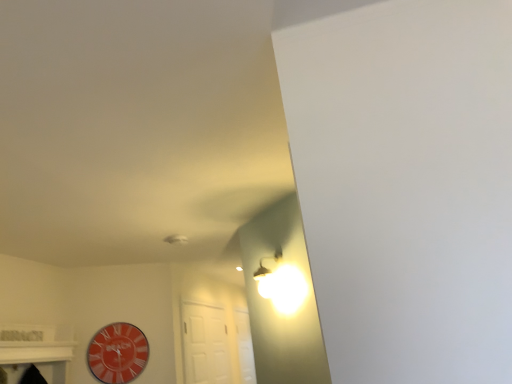
This screenshot has width=512, height=384. What do you see at coordinates (117, 353) in the screenshot? I see `orange glossy clock at lower left` at bounding box center [117, 353].

Find the location of `orange glossy clock at lower left`. orange glossy clock at lower left is located at coordinates (117, 353).

Locate an element on the screen. white matte door at center is located at coordinates (205, 344).

What do you see at coordinates (205, 344) in the screenshot?
I see `white matte door at center` at bounding box center [205, 344].

Locate an element on the screen. orange glossy clock at lower left is located at coordinates (117, 353).

Can you confirm if orange glossy clock at lower left is positioned to the left of white matte door at center?

Yes, orange glossy clock at lower left is to the left of white matte door at center.

Considering the relative positions of orange glossy clock at lower left and white matte door at center in the image provided, is orange glossy clock at lower left behind white matte door at center?

No.

Is point (133, 370) less distant than point (209, 345)?

Yes.

From the image's perspective, which is below, orange glossy clock at lower left or white matte door at center?

white matte door at center.

From a real-world perspective, is orange glossy clock at lower left physically located above or below white matte door at center?

In terms of real-world spatial position, orange glossy clock at lower left is above white matte door at center.

In the scene shown: Is orange glossy clock at lower left wider or thinner than white matte door at center?

Considering their sizes, orange glossy clock at lower left looks slimmer than white matte door at center.

From their relative heights in the image, would you say orange glossy clock at lower left is taller or shorter than white matte door at center?

orange glossy clock at lower left is shorter than white matte door at center.

Which of these two, orange glossy clock at lower left or white matte door at center, is smaller?

orange glossy clock at lower left.

In the scene shown: Is orange glossy clock at lower left not within white matte door at center?

Yes, orange glossy clock at lower left is outside of white matte door at center.

Is orange glossy clock at lower left not close to white matte door at center?

That's not correct — orange glossy clock at lower left is a little close to white matte door at center.

Is orange glossy clock at lower left oriented away from white matte door at center?

orange glossy clock at lower left does not have its back to white matte door at center.

How far apart are orange glossy clock at lower left and white matte door at center?

The distance of orange glossy clock at lower left from white matte door at center is 91.08 centimeters.

At what (x,y) coordinates should I click in order to perform the action: click on door lying behind the orange glossy clock at lower left. Please return your answer as a coordinate pair (x, y). Image resolution: width=512 pixels, height=384 pixels. Looking at the image, I should click on (205, 344).

Considering the relative positions of white matte door at center and orange glossy clock at lower left in the image provided, is white matte door at center to the left or to the right of orange glossy clock at lower left?

Clearly, white matte door at center is on the right of orange glossy clock at lower left in the image.

Is white matte door at center in front of or behind orange glossy clock at lower left in the image?

In the image, white matte door at center appears behind orange glossy clock at lower left.

Between point (205, 341) and point (137, 360), which one is positioned behind?

The point (205, 341) is farther from the camera.

From the image's perspective, between white matte door at center and orange glossy clock at lower left, who is located below?

white matte door at center appears lower in the image.

From a real-world perspective, is white matte door at center below orange glossy clock at lower left?

Yes, from a real-world perspective, white matte door at center is beneath orange glossy clock at lower left.

In the scene shown: Considering the relative sizes of white matte door at center and orange glossy clock at lower left in the image provided, is white matte door at center thinner than orange glossy clock at lower left?

In fact, white matte door at center might be wider than orange glossy clock at lower left.

Is white matte door at center taller or shorter than orange glossy clock at lower left?

white matte door at center is taller than orange glossy clock at lower left.

Considering the sizes of objects white matte door at center and orange glossy clock at lower left in the image provided, who is bigger, white matte door at center or orange glossy clock at lower left?

Bigger between the two is white matte door at center.

Do you think white matte door at center is within orange glossy clock at lower left, or outside of it?

white matte door at center is not enclosed by orange glossy clock at lower left.

Consider the image. Is white matte door at center positioned far away from orange glossy clock at lower left?

white matte door at center is near orange glossy clock at lower left, not far away.

Is white matte door at center turned away from orange glossy clock at lower left?

No, orange glossy clock at lower left is not at the back of white matte door at center.

How different are the orientations of white matte door at center and orange glossy clock at lower left in degrees?

white matte door at center and orange glossy clock at lower left are facing 60 degrees away from each other.

I want to click on wall clock above the white matte door at center (from the image's perspective), so click(x=117, y=353).

I want to click on door below the orange glossy clock at lower left (from the image's perspective), so click(x=205, y=344).

In order to click on door lying behind the orange glossy clock at lower left in this screenshot , I will do `click(205, 344)`.